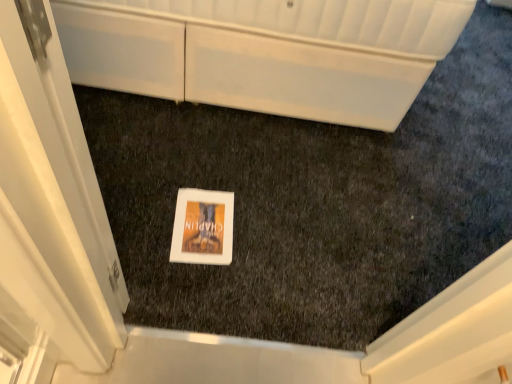
At what (x,y) coordinates should I click in order to perform the action: click on vacant space behind white glossy door at center. Please return your answer as a coordinate pair (x, y). Looking at the image, I should click on [146, 256].